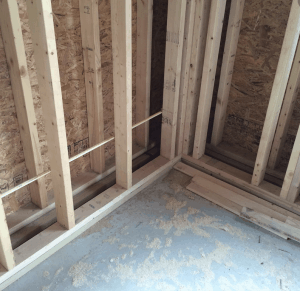
This screenshot has width=300, height=291. Find the location of `composite wood interior walls`. composite wood interior walls is located at coordinates (5, 155), (77, 133), (108, 70), (250, 34).